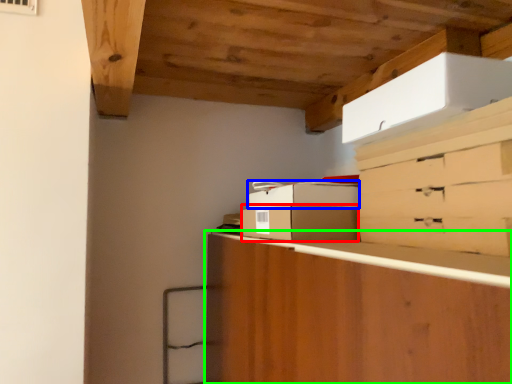
Question: Which is farther away from cardboard box (highlighted by a red box)? cardboard box (highlighted by a blue box) or cabinetry (highlighted by a green box)?

Choices:
 (A) cardboard box
 (B) cabinetry

Answer: (B)